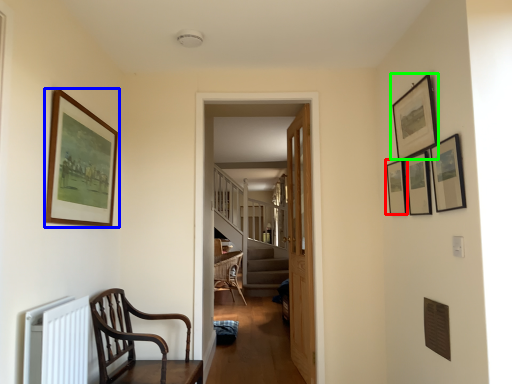
Question: Which object is positioned farthest from picture frame (highlighted by a red box)? Select from picture frame (highlighted by a blue box) and picture frame (highlighted by a green box).

Choices:
 (A) picture frame
 (B) picture frame

Answer: (A)